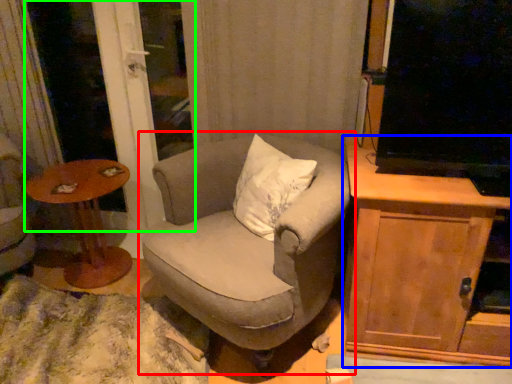
Question: Considering the real-world distances, which object is closest to chair (highlighted by a red box)? cabinetry (highlighted by a blue box) or screen door (highlighted by a green box).

Choices:
 (A) cabinetry
 (B) screen door

Answer: (A)